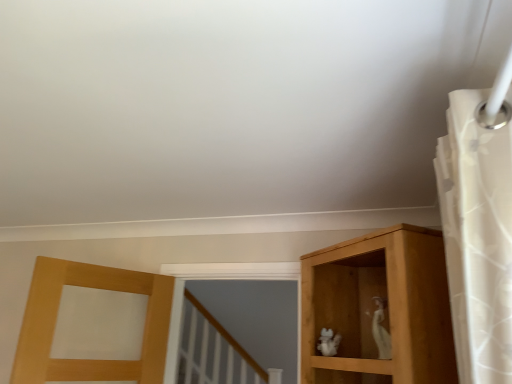
Find the location of a particular element. The image size is (512, 384). white sheer fabric at upper right is located at coordinates (477, 238).

What do you see at coordinates (477, 238) in the screenshot? I see `white sheer fabric at upper right` at bounding box center [477, 238].

Measure the distance between point (509, 145) and camera.

34.41 inches.

Find the location of a particular element. This screenshot has width=512, height=384. white porcelain cat at center-right is located at coordinates (381, 329).

The image size is (512, 384). Describe the element at coordinates (381, 329) in the screenshot. I see `white porcelain cat at center-right` at that location.

What is the approximate width of white porcelain cat at center-right?

white porcelain cat at center-right is 3.22 inches in width.

You are a GUI agent. You are given a task and a screenshot of the screen. Output one action in this format:
    pyautogui.click(x=<x>, y=<y>)
    Task: Click on the white sheer fabric at upper right
    This screenshot has height=384, width=512.
    Given the screenshot: What is the action you would take?
    click(477, 238)

Looking at this image, would you say white porcelain cat at center-right is to the left or to the right of white sheer fabric at upper right in the picture?

Based on their positions, white porcelain cat at center-right is located to the left of white sheer fabric at upper right.

Which object is further away from the camera taking this photo, white porcelain cat at center-right or white sheer fabric at upper right?

white porcelain cat at center-right is further from the camera.

Is point (367, 311) positioned after point (498, 300)?

That is True.

Based on the photo, from the image's perspective, who appears lower, white porcelain cat at center-right or white sheer fabric at upper right?

white porcelain cat at center-right, from the image's perspective.

From a real-world perspective, which object stands above the other?

In real-world perspective, white sheer fabric at upper right is above.

Is white porcelain cat at center-right wider or thinner than white sheer fabric at upper right?

Clearly, white porcelain cat at center-right has less width compared to white sheer fabric at upper right.

Which of these two, white porcelain cat at center-right or white sheer fabric at upper right, stands taller?

white sheer fabric at upper right is taller.

Considering the relative sizes of white porcelain cat at center-right and white sheer fabric at upper right in the image provided, is white porcelain cat at center-right smaller than white sheer fabric at upper right?

Yes, white porcelain cat at center-right is smaller than white sheer fabric at upper right.

Is white sheer fabric at upper right surrounded by white porcelain cat at center-right?

No, white sheer fabric at upper right is not inside white porcelain cat at center-right.

Is white porcelain cat at center-right not close to white sheer fabric at upper right?

No, white porcelain cat at center-right is in close proximity to white sheer fabric at upper right.

Is white porcelain cat at center-right oriented away from white sheer fabric at upper right?

No, white porcelain cat at center-right is not facing away from white sheer fabric at upper right.

What's the angular difference between white porcelain cat at center-right and white sheer fabric at upper right's facing directions?

42.6 degrees separate the facing orientations of white porcelain cat at center-right and white sheer fabric at upper right.

Image resolution: width=512 pixels, height=384 pixels. I want to click on animal lying behind the white sheer fabric at upper right, so click(x=381, y=329).

Considering the relative positions of white sheer fabric at upper right and white porcelain cat at center-right in the image provided, is white sheer fabric at upper right to the left of white porcelain cat at center-right from the viewer's perspective?

No, white sheer fabric at upper right is not to the left of white porcelain cat at center-right.

Is the position of white sheer fabric at upper right less distant than that of white porcelain cat at center-right?

Yes, white sheer fabric at upper right is closer to the camera.

Is point (482, 287) closer to camera compared to point (380, 310)?

Yes.

From the image's perspective, relative to white porcelain cat at center-right, is white sheer fabric at upper right above or below?

white sheer fabric at upper right is above white porcelain cat at center-right.

From a real-world perspective, who is located lower, white sheer fabric at upper right or white porcelain cat at center-right?

white porcelain cat at center-right is physically lower.

Based on the photo, can you confirm if white sheer fabric at upper right is thinner than white porcelain cat at center-right?

Incorrect, the width of white sheer fabric at upper right is not less than that of white porcelain cat at center-right.

Considering the relative sizes of white sheer fabric at upper right and white porcelain cat at center-right in the image provided, is white sheer fabric at upper right shorter than white porcelain cat at center-right?

In fact, white sheer fabric at upper right may be taller than white porcelain cat at center-right.

Does white sheer fabric at upper right have a larger size compared to white porcelain cat at center-right?

Yes, white sheer fabric at upper right is bigger than white porcelain cat at center-right.

Would you say white sheer fabric at upper right contains white porcelain cat at center-right?

No, white porcelain cat at center-right is not inside white sheer fabric at upper right.

Is white sheer fabric at upper right not close to white porcelain cat at center-right?

No, there isn't a large distance between white sheer fabric at upper right and white porcelain cat at center-right.

Does white sheer fabric at upper right turn towards white porcelain cat at center-right?

No, white sheer fabric at upper right is not facing towards white porcelain cat at center-right.

How different are the orientations of white sheer fabric at upper right and white porcelain cat at center-right in degrees?

42.6 degrees.

Where is `shower curtain above the white porcelain cat at center-right (from a real-world perspective)`? shower curtain above the white porcelain cat at center-right (from a real-world perspective) is located at coordinates (477, 238).

The width and height of the screenshot is (512, 384). Find the location of `animal below the white sheer fabric at upper right (from a real-world perspective)`. animal below the white sheer fabric at upper right (from a real-world perspective) is located at coordinates (381, 329).

Locate an element on the screen. The width and height of the screenshot is (512, 384). shower curtain in front of the white porcelain cat at center-right is located at coordinates (477, 238).